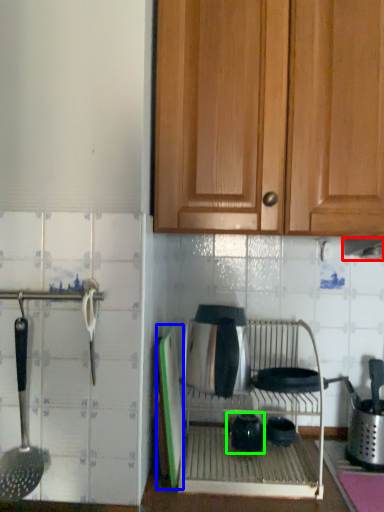
Question: Which object is positioned farthest from exhaust hood (highlighted by a red box)? Select from screen door (highlighted by a blue box) and tea pot (highlighted by a green box).

Choices:
 (A) screen door
 (B) tea pot

Answer: (A)